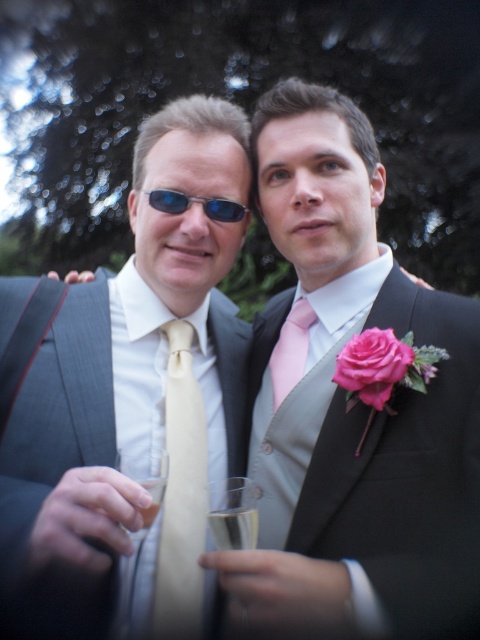
Is point (96, 376) more distant than point (167, 499)?

Yes, it is.

The image size is (480, 640). What do you see at coordinates (57, 464) in the screenshot? I see `matte gray suit at left` at bounding box center [57, 464].

You are a GUI agent. You are given a task and a screenshot of the screen. Output one action in this format:
    pyautogui.click(x=<x>, y=<y>)
    Task: Click on the matte gray suit at left
    The height and width of the screenshot is (640, 480).
    Given the screenshot: What is the action you would take?
    pyautogui.click(x=57, y=464)

Who is taller, pink satin tie at center or clear glass champagne at center?

pink satin tie at center is taller.

Is pink satin tie at center positioned at the back of clear glass champagne at center?

Yes, it is behind clear glass champagne at center.

Is point (290, 355) positioned in front of point (250, 525)?

No, it is not.

I want to click on pink satin tie at center, so 290,349.

Between matte gray suit at left and pink satin tie at center, which one is positioned lower?

Positioned lower is matte gray suit at left.

Is matte gray suit at left thinner than pink satin tie at center?

Incorrect, matte gray suit at left's width is not less than pink satin tie at center's.

I want to click on matte gray suit at left, so 57,464.

Identify the location of matte gray suit at left. (57, 464).